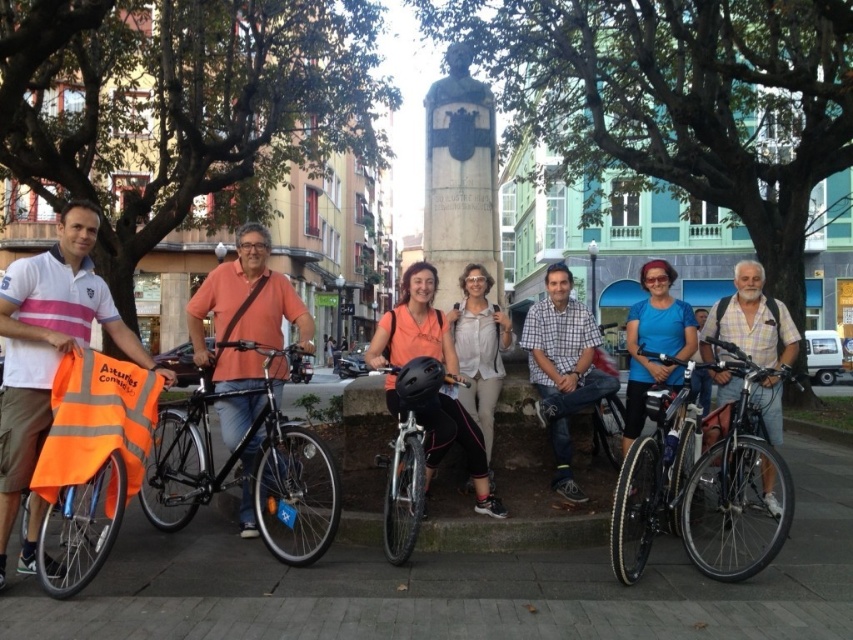
Measure the distance between shiny metallic bicycle at right and white matte jacket at center.

The distance of shiny metallic bicycle at right from white matte jacket at center is 6.78 feet.

Can you confirm if shiny metallic bicycle at right is thinner than white matte jacket at center?

No.

Which is in front, point (747, 413) or point (457, 394)?

Point (747, 413) is more forward.

You are a GUI agent. You are given a task and a screenshot of the screen. Output one action in this format:
    pyautogui.click(x=<x>, y=<y>)
    Task: Click on the shiny metallic bicycle at right
    
    Given the screenshot: What is the action you would take?
    pyautogui.click(x=735, y=486)

From the picture: Does matte black helmet at center have a lesser height compared to white matte jacket at center?

No, matte black helmet at center is not shorter than white matte jacket at center.

Who is more forward, (392, 321) or (469, 289)?

Point (392, 321) is in front.

Is point (453, 348) more distant than point (476, 419)?

No.

Identify the location of matte black helmet at center. The height and width of the screenshot is (640, 853). (415, 324).

Does gray concrete pavement at center have a larger size compared to blue matte shirt at center?

No, gray concrete pavement at center is not bigger than blue matte shirt at center.

Does gray concrete pavement at center have a lesser height compared to blue matte shirt at center?

Yes.

Measure the distance between gray concrete pavement at center and camera.

The distance of gray concrete pavement at center from camera is 4.22 meters.

Where is `gray concrete pavement at center`? gray concrete pavement at center is located at coordinates (457, 580).